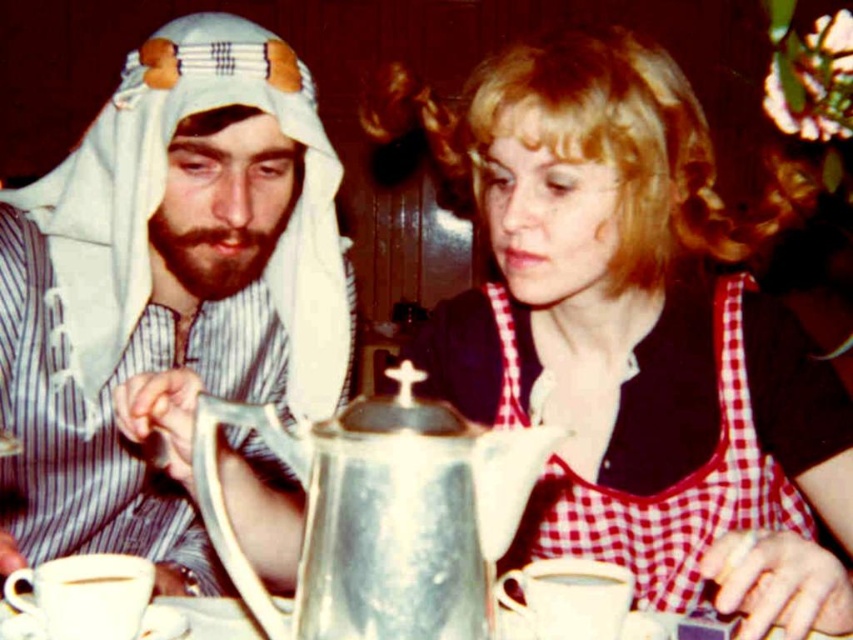
Looking at this image, is matte white teapot at center shorter than metallic silver coffee pot at center?

In fact, matte white teapot at center may be taller than metallic silver coffee pot at center.

Looking at this image, can you confirm if matte white teapot at center is smaller than metallic silver coffee pot at center?

Actually, matte white teapot at center might be larger than metallic silver coffee pot at center.

Does point (817, 509) come farther from viewer compared to point (125, 580)?

Yes, point (817, 509) is behind point (125, 580).

Locate an element on the screen. Image resolution: width=853 pixels, height=640 pixels. matte white teapot at center is located at coordinates (633, 330).

Can you confirm if matte white teapot at center is positioned above silver metallic teapot at center?

Yes, matte white teapot at center is above silver metallic teapot at center.

Can you confirm if matte white teapot at center is positioned to the left of silver metallic teapot at center?

In fact, matte white teapot at center is to the right of silver metallic teapot at center.

Which is in front, point (440, 112) or point (396, 372)?

Point (396, 372) is more forward.

This screenshot has width=853, height=640. What are the coordinates of `matte white teapot at center` in the screenshot? It's located at (633, 330).

Is matte white teapot at center closer to the viewer compared to white matte headscarf at left?

That is True.

Is point (668, 435) in front of point (16, 470)?

Yes.

The width and height of the screenshot is (853, 640). Identify the location of matte white teapot at center. (633, 330).